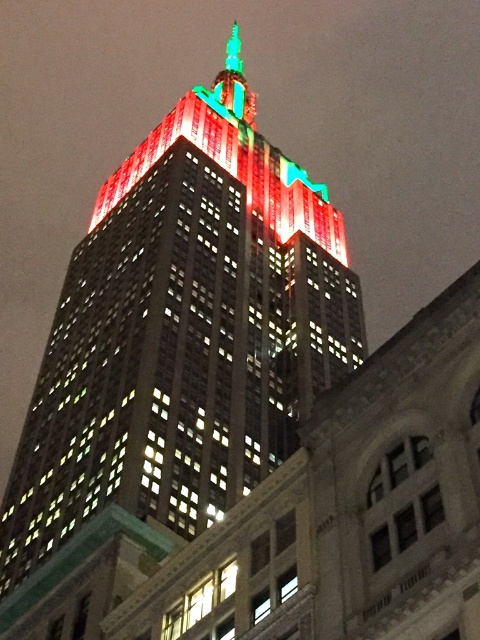
What do you see at coordinates (182, 339) in the screenshot?
I see `matte glass skyscraper at center` at bounding box center [182, 339].

Which of these two, matte glass skyscraper at center or shiny glass spire at upper center, stands taller?

shiny glass spire at upper center is taller.

Find the location of a particular element. Image resolution: width=480 pixels, height=640 pixels. matte glass skyscraper at center is located at coordinates (182, 339).